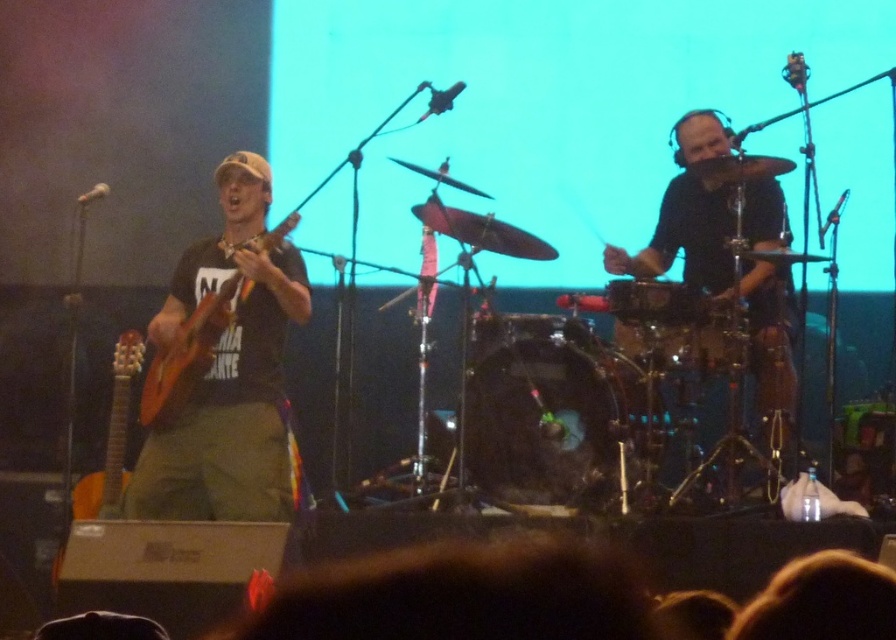
You are a stagehand trying to move the black drum at center and the black matte drum set at right. Which object is closer to the front of the stage?

The black drum at center is closer to the front of the stage because it is in front of the black matte drum set at right.

You are a stagehand who needs to place two guitars, the orange wood guitar at left and the acoustic wood guitar at left, into a storage case that can only accommodate the narrower of the two. Based on the description, which guitar should you choose to fit into the case?

The acoustic wood guitar at left should be chosen because the orange wood guitar at left might be wider, making the acoustic wood guitar at left the narrower option that fits the storage case.